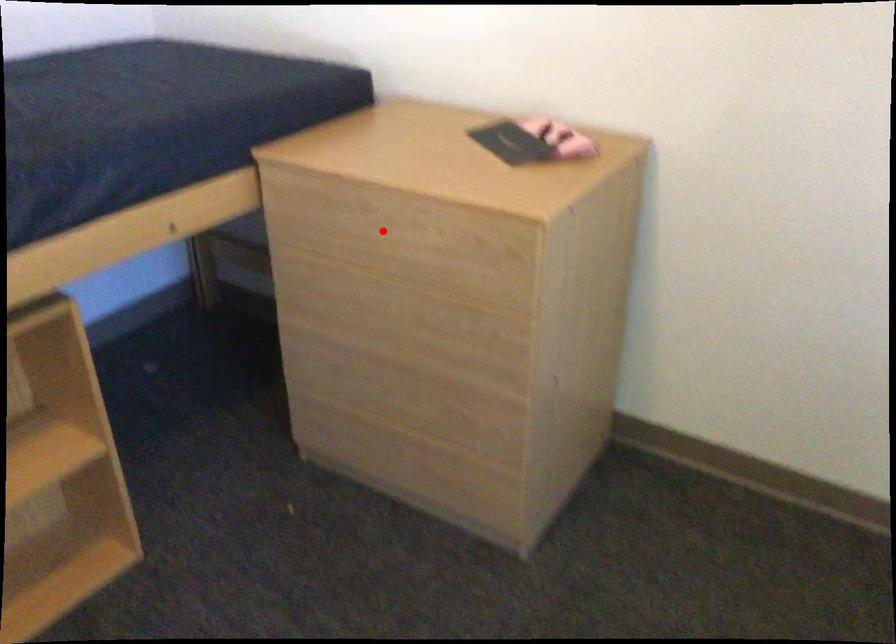
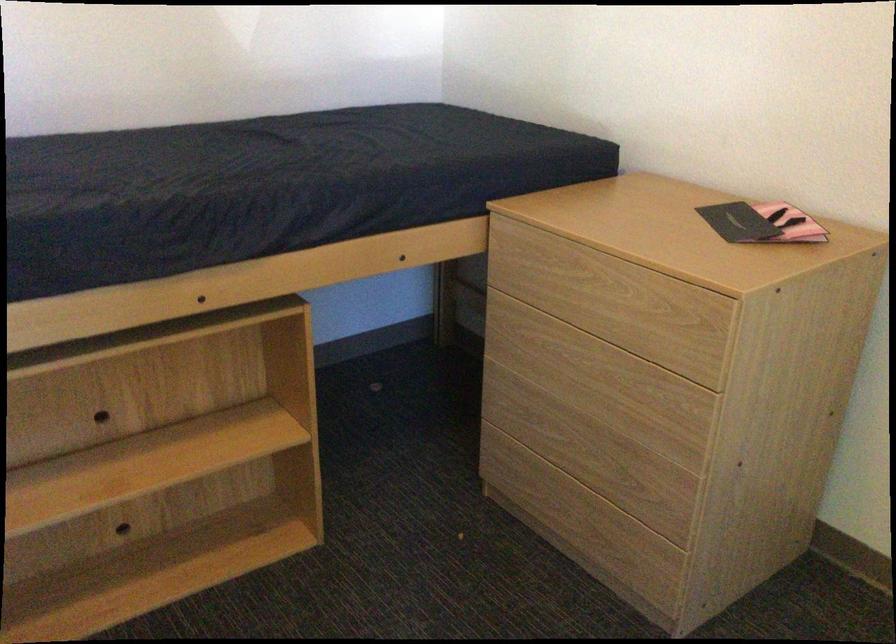
Find the pixel in the second image that matches the highlighted location in the first image.

(582, 287)